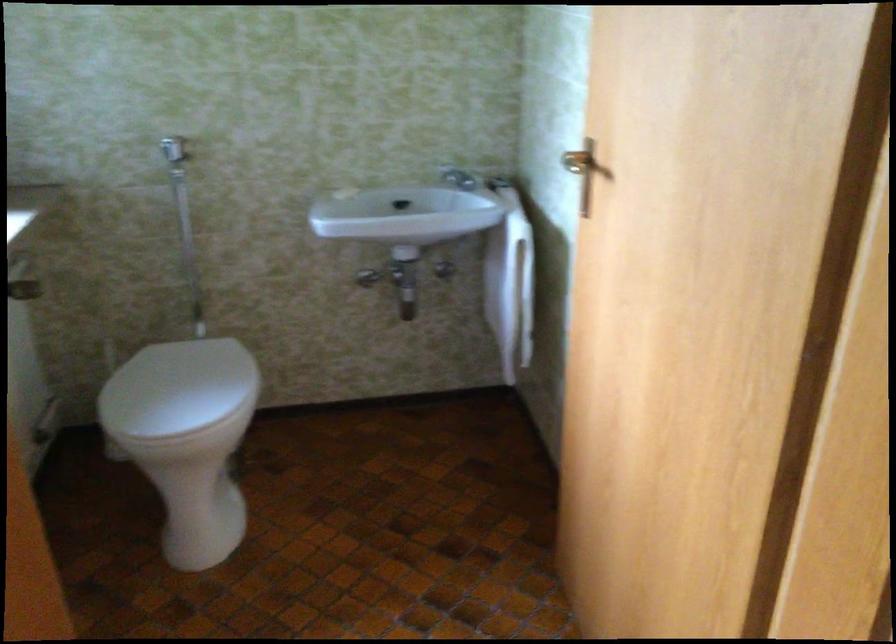
Where is `white toilet lid`? This screenshot has width=896, height=644. white toilet lid is located at coordinates (177, 388).